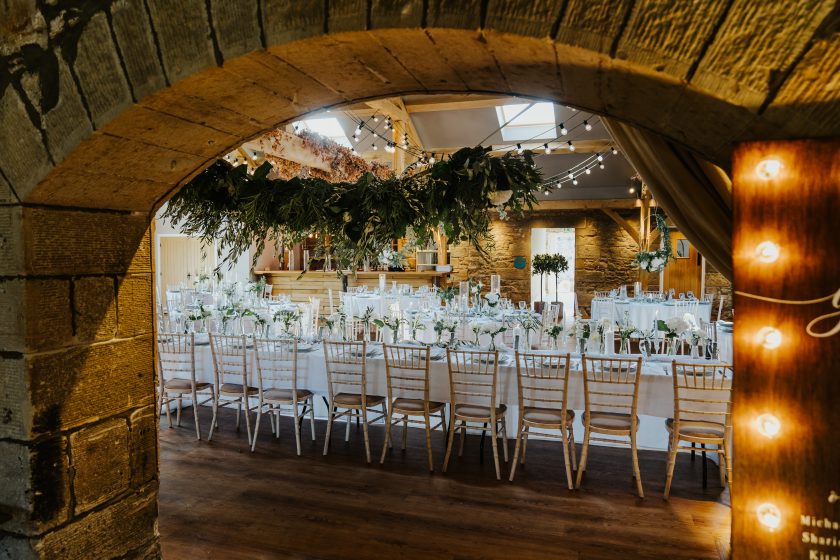
Image resolution: width=840 pixels, height=560 pixels. What are the coordinates of `dinnerware` in the screenshot? It's located at (428, 353).